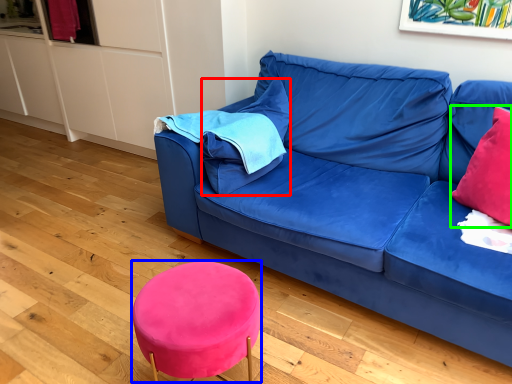
Question: Estimate the real-world distances between objects in this image. Which object is closer to pillow (highlighted by a red box), bar stool (highlighted by a blue box) or throw pillow (highlighted by a green box)?

Choices:
 (A) bar stool
 (B) throw pillow

Answer: (A)